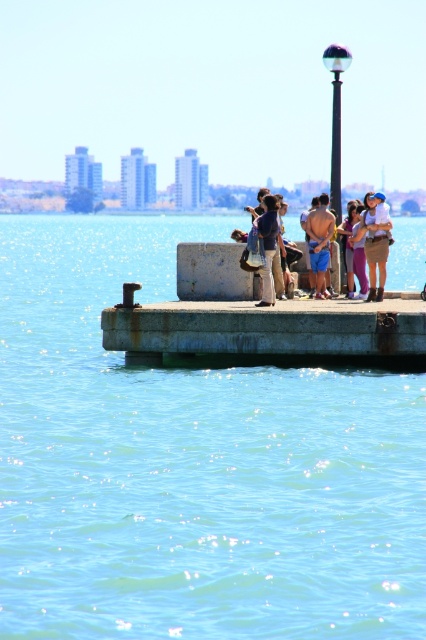
Is point (157, 339) positioned before point (331, 81)?

Yes, it is.

Can you confirm if rusty concrete dock at center is positioned below shiny glass lamp post at upper center?

Indeed, rusty concrete dock at center is positioned under shiny glass lamp post at upper center.

I want to click on rusty concrete dock at center, so click(x=268, y=332).

Locate an element on the screen. rusty concrete dock at center is located at coordinates (268, 332).

Which is below, denim jacket at center or dark blue shirt at center?

Positioned lower is dark blue shirt at center.

Between point (351, 250) and point (262, 204), which one is positioned behind?

The point (351, 250) is behind.

Does point (348, 216) lie behind point (261, 296)?

Yes, it is behind point (261, 296).

Locate an element on the screen. Image resolution: width=426 pixels, height=640 pixels. denim jacket at center is located at coordinates (353, 248).

Is point (206, 349) behind point (270, 296)?

No.

From the picture: Is rusty concrete dock at center shorter than dark blue shirt at center?

Indeed, rusty concrete dock at center has a lesser height compared to dark blue shirt at center.

Find the location of a particular element. rusty concrete dock at center is located at coordinates (268, 332).

Where is `rusty concrete dock at center`? The height and width of the screenshot is (640, 426). rusty concrete dock at center is located at coordinates (268, 332).